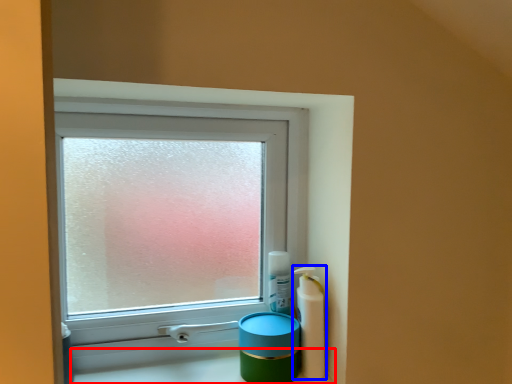
Question: Among these objects, which one is farthest to the camera, counter top (highlighted by a red box) or mouthwash (highlighted by a blue box)?

Choices:
 (A) counter top
 (B) mouthwash

Answer: (B)